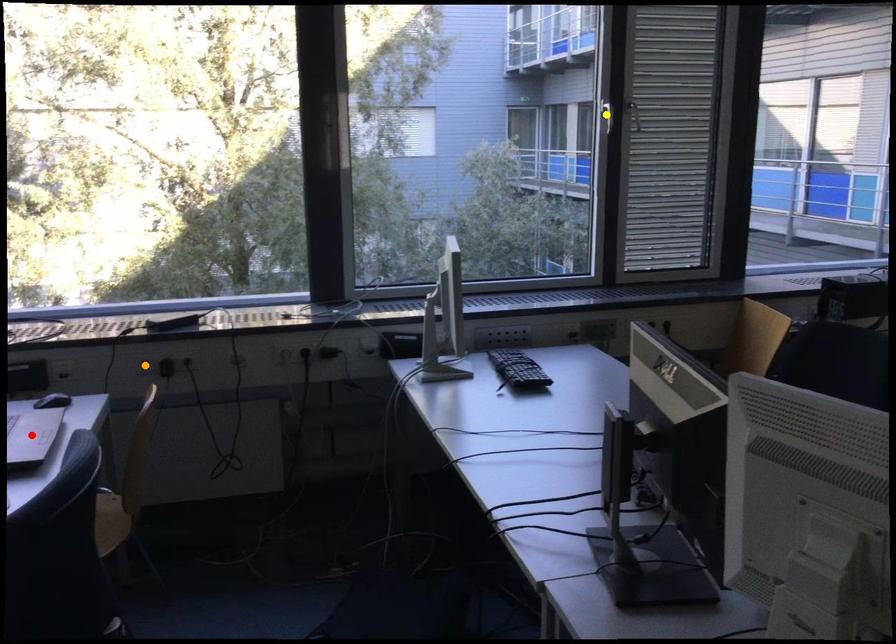
Consider the image. Order these from nearest to farthest:
A) orange point
B) yellow point
C) red point

red point < orange point < yellow point